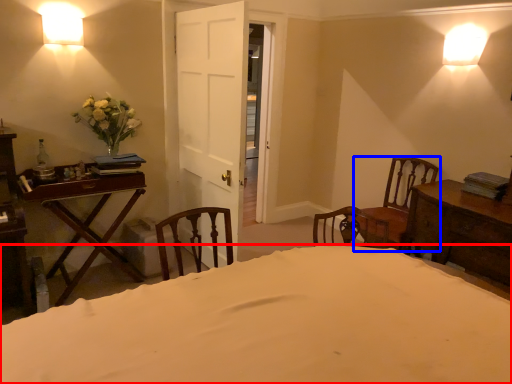
Question: Which point is closer to the camera, bed (highlighted by a red box) or chair (highlighted by a blue box)?

Choices:
 (A) bed
 (B) chair

Answer: (A)